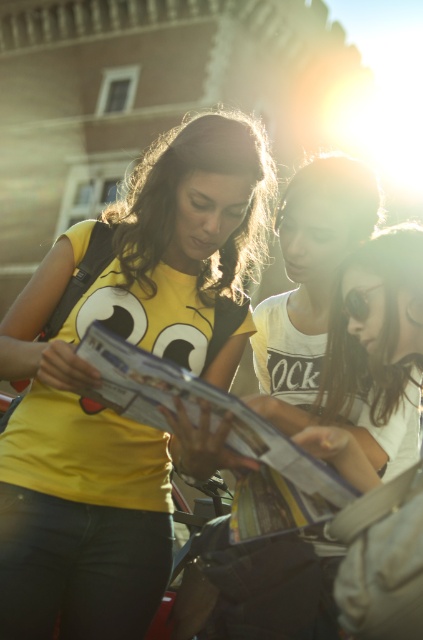
Question: Is yellow matte t-shirt at center closer to the viewer compared to printed paper magazine at center?

Choices:
 (A) yes
 (B) no

Answer: (A)

Question: Which object is positioned farthest from the white matte shirt at center?

Choices:
 (A) printed paper magazine at center
 (B) yellow matte t-shirt at center

Answer: (B)

Question: Among these objects, which one is nearest to the camera?

Choices:
 (A) yellow matte t-shirt at center
 (B) white matte shirt at center

Answer: (A)

Question: Considering the real-world distances, which object is closest to the yellow matte t-shirt at center?

Choices:
 (A) white matte shirt at center
 (B) printed paper magazine at center

Answer: (B)

Question: Can you confirm if yellow matte t-shirt at center is smaller than printed paper magazine at center?

Choices:
 (A) no
 (B) yes

Answer: (A)

Question: Can you confirm if yellow matte t-shirt at center is smaller than white matte shirt at center?

Choices:
 (A) yes
 (B) no

Answer: (B)